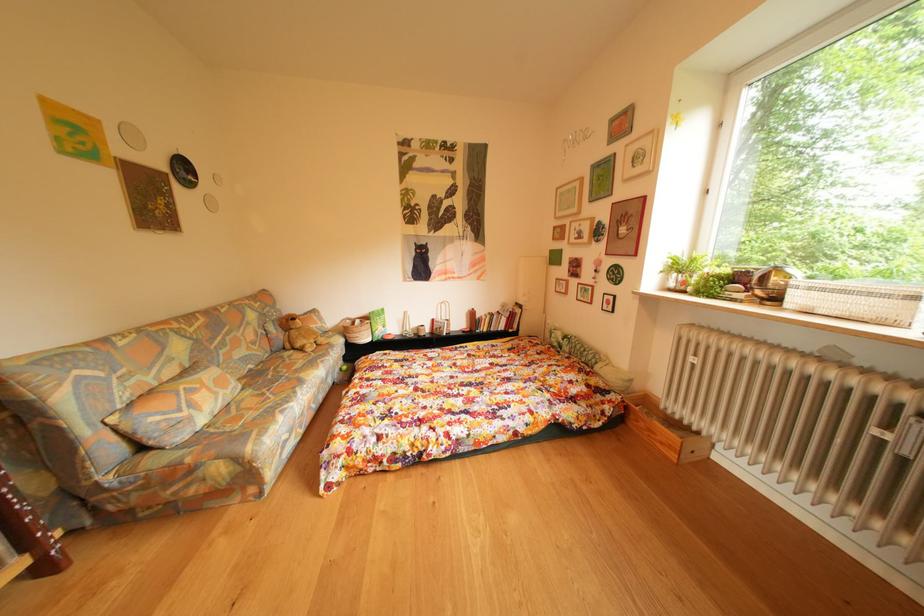
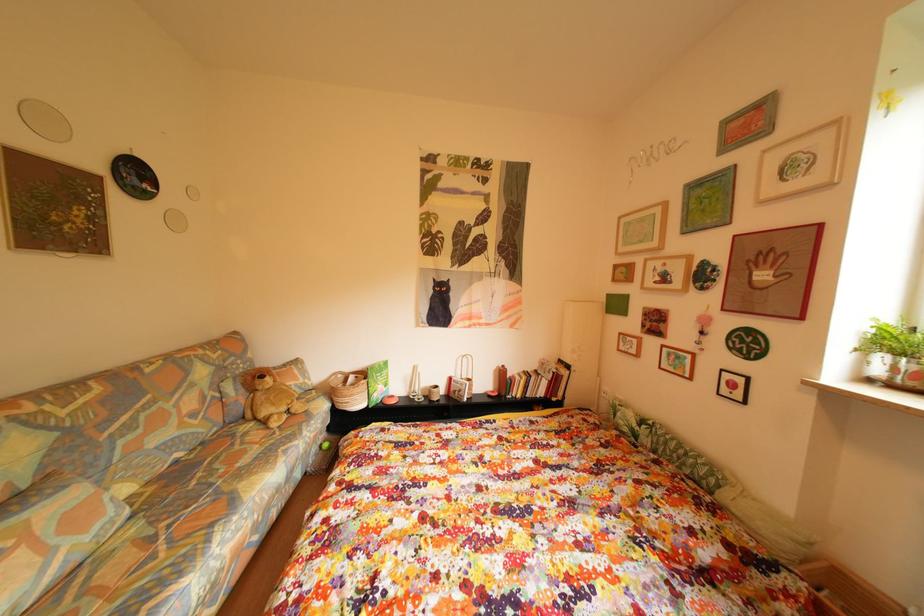
Question: Based on the continuous images, in which direction is the camera rotating? Reply with the corresponding letter.

Choices:
 (A) Left
 (B) Right
 (C) Up
 (D) Down

Answer: (C)